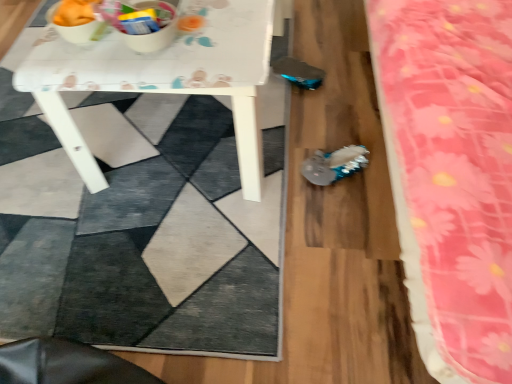
You are a GUI agent. You are given a task and a screenshot of the screen. Output one action in this format:
    pyautogui.click(x=<x>, y=<y>)
    Task: Click on the unoccupied space behind shiny metallic shoe at center
    The width and height of the screenshot is (512, 384).
    Given the screenshot: What is the action you would take?
    pyautogui.click(x=325, y=129)